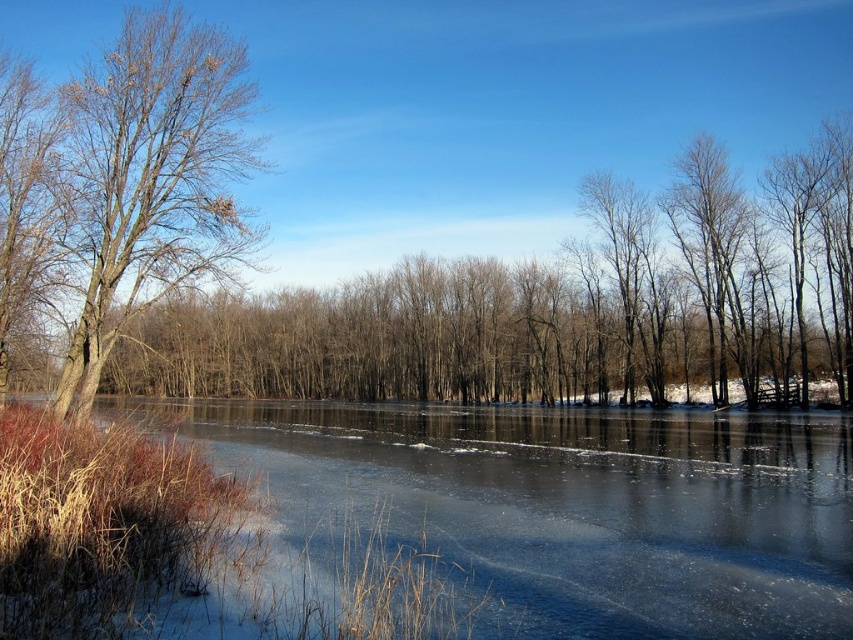
Is point (201, 440) positioned before point (178, 97)?

No, (201, 440) is behind (178, 97).

Does point (491, 426) come in front of point (114, 237)?

No.

Locate an element on the screen. The height and width of the screenshot is (640, 853). frozen ice at center is located at coordinates (566, 506).